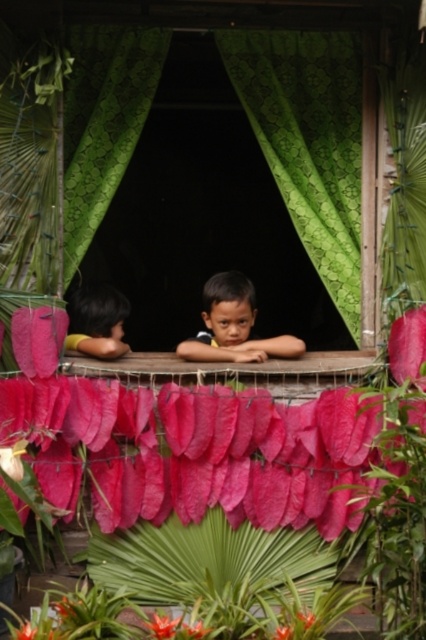
You are a painter standing in front of the window. You want to paint the green textured curtain at center and the bright pink petal at lower center. Which object should you focus on first if you are using a standard brush that can only reach up to 1 meter in height?

The green textured curtain at center has a greater height compared to the bright pink petal at lower center. Since the brush can only reach up to 1 meter, you should focus on the taller green textured curtain at center first to ensure you can paint its entire height before it becomes inaccessible.

You are a florist trying to arrange these two items in a vase. The orange matte flower at lower center and the bright pink fabric at lower center are both placed in the same vase. Which one should you place in the center to make the arrangement look balanced?

The orange matte flower at lower center should be placed in the center because its larger width compared to the bright pink fabric at lower center will create a balanced arrangement.

You are standing in front of the window with the green patterned curtains and want to hang a small decoration exactly at the center of the green textured curtain at center. According to the coordinates provided, where should you place it?

The green textured curtain at center should be placed at the coordinates point [308,140].